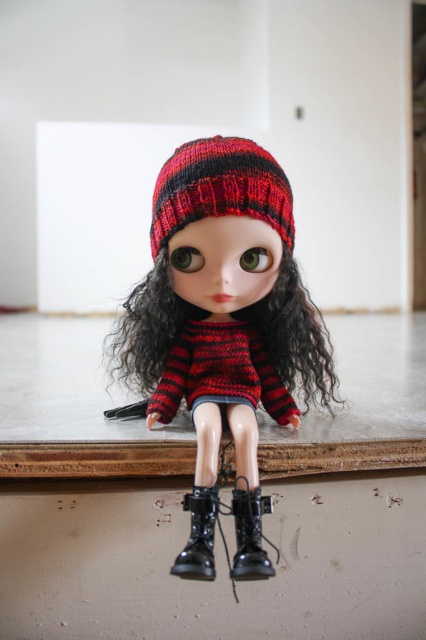
You are a fashion designer looking at the doll in the image. You need to determine which item is more to the left between the knitted woolen beanie at center and the knitted red and black sweater at center. Can you tell me which one is positioned further to the left?

The knitted woolen beanie at center is positioned on the left side of knitted red and black sweater at center, so the knitted woolen beanie at center is more to the left.

You are a photographer trying to capture the knitted woolen hat at center in your shot. You want to ensure the hat is in focus while the background remains blurred. Given that the hat is 29.12 inches from the camera, what should you set the focal length to?

The knitted woolen hat at center is 29.12 inches from the viewer, so you should set the focal length to 29.12 inches to ensure it is in focus while keeping the background blurred.